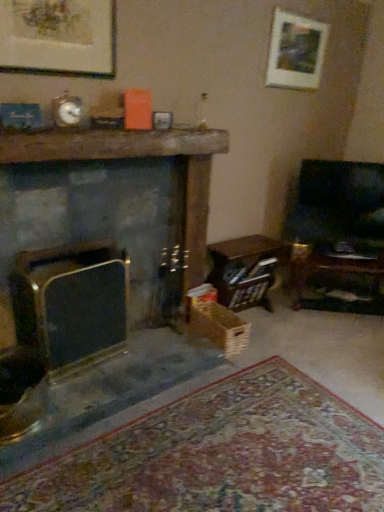
Measure the distance between point (72, 60) and camera.

Point (72, 60) and camera are 1.89 meters apart.

The width and height of the screenshot is (384, 512). Describe the element at coordinates (58, 37) in the screenshot. I see `matte gold picture frame at upper left, which appears as the 2th picture frame when viewed from the right` at that location.

The image size is (384, 512). What do you see at coordinates (219, 327) in the screenshot?
I see `wooden crate at lower center` at bounding box center [219, 327].

Image resolution: width=384 pixels, height=512 pixels. Find the location of `dark gray stone fireplace at center, placed as the 1th fireplace when sorted from right to left`. dark gray stone fireplace at center, placed as the 1th fireplace when sorted from right to left is located at coordinates (138, 157).

Measure the distance between dark wood rocking chair at right and camera.

The depth of dark wood rocking chair at right is 2.85 meters.

The height and width of the screenshot is (512, 384). Find the location of `matte gold picture frame at upper left, the 1th picture frame ordered from the bottom`. matte gold picture frame at upper left, the 1th picture frame ordered from the bottom is located at coordinates (58, 37).

How much distance is there between dark wood rocking chair at right and white matte picture frame at upper right, the second picture frame from the bottom?

32.76 inches.

Which object is closer to the camera, dark wood rocking chair at right or white matte picture frame at upper right, the second picture frame from the bottom?

white matte picture frame at upper right, the second picture frame from the bottom, is in front.

From a real-world perspective, is dark wood rocking chair at right on white matte picture frame at upper right, which is counted as the 1th picture frame, starting from the top?

Incorrect, from a real-world perspective, dark wood rocking chair at right is lower than white matte picture frame at upper right, which is counted as the 1th picture frame, starting from the top.

Considering the positions of point (304, 192) and point (315, 58), is point (304, 192) closer or farther from the camera than point (315, 58)?

Point (304, 192) is positioned farther from the camera compared to point (315, 58).

Considering the sizes of objects white matte picture frame at upper right, which is counted as the 1th picture frame, starting from the top, and matte black fireplace at left, which is the first fireplace from left to right, in the image provided, who is thinner, white matte picture frame at upper right, which is counted as the 1th picture frame, starting from the top, or matte black fireplace at left, which is the first fireplace from left to right,?

Thinner between the two is white matte picture frame at upper right, which is counted as the 1th picture frame, starting from the top.

Which object is closer to the camera taking this photo, white matte picture frame at upper right, the second picture frame from the bottom, or matte black fireplace at left, which is the first fireplace from left to right?

matte black fireplace at left, which is the first fireplace from left to right, is in front.

From the image's perspective, is white matte picture frame at upper right, acting as the first picture frame starting from the back, located above or below matte black fireplace at left, which is the first fireplace from left to right?

white matte picture frame at upper right, acting as the first picture frame starting from the back, is above matte black fireplace at left, which is the first fireplace from left to right.

Which object is positioned more to the left, white matte picture frame at upper right, placed as the 2th picture frame when sorted from front to back, or matte black fireplace at left, which is the first fireplace from left to right?

matte black fireplace at left, which is the first fireplace from left to right.

Does wooden crate at lower right have a larger size compared to matte gold picture frame at upper left, which is the 2th picture frame in top-to-bottom order?

Indeed, wooden crate at lower right has a larger size compared to matte gold picture frame at upper left, which is the 2th picture frame in top-to-bottom order.

Is wooden crate at lower right facing towards matte gold picture frame at upper left, which is the 2th picture frame in top-to-bottom order?

No, wooden crate at lower right is not aimed at matte gold picture frame at upper left, which is the 2th picture frame in top-to-bottom order.

Does point (248, 288) come closer to viewer compared to point (97, 1)?

No.

Which of these two, wooden crate at lower right or matte gold picture frame at upper left, the 1th picture frame in the front-to-back sequence, is wider?

With larger width is wooden crate at lower right.

Considering the sizes of dark gray stone fireplace at center, placed as the 1th fireplace when sorted from right to left, and matte black fireplace at left, which is the first fireplace from left to right, in the image, is dark gray stone fireplace at center, placed as the 1th fireplace when sorted from right to left, wider or thinner than matte black fireplace at left, which is the first fireplace from left to right,?

dark gray stone fireplace at center, placed as the 1th fireplace when sorted from right to left, is wider than matte black fireplace at left, which is the first fireplace from left to right.

From the picture: Is dark gray stone fireplace at center, placed as the 1th fireplace when sorted from right to left, at the left side of matte black fireplace at left, the second fireplace positioned from the right?

No, dark gray stone fireplace at center, placed as the 1th fireplace when sorted from right to left, is not to the left of matte black fireplace at left, the second fireplace positioned from the right.

Is matte black fireplace at left, the second fireplace positioned from the right, surrounded by dark gray stone fireplace at center, which is the second fireplace in left-to-right order?

That's incorrect, matte black fireplace at left, the second fireplace positioned from the right, is not inside dark gray stone fireplace at center, which is the second fireplace in left-to-right order.

Is dark gray stone fireplace at center, which is the second fireplace in left-to-right order, positioned before matte black fireplace at left, which is the first fireplace from left to right?

Yes, dark gray stone fireplace at center, which is the second fireplace in left-to-right order, is closer to the camera.

Where is `the 2nd fireplace to the right of the matte gold picture frame at upper left, the 1th picture frame ordered from the bottom, starting your count from the anchor`? This screenshot has width=384, height=512. the 2nd fireplace to the right of the matte gold picture frame at upper left, the 1th picture frame ordered from the bottom, starting your count from the anchor is located at coordinates (138, 157).

Is matte gold picture frame at upper left, the 1th picture frame in the front-to-back sequence, oriented away from dark gray stone fireplace at center, which is the second fireplace in left-to-right order?

That's not correct — matte gold picture frame at upper left, the 1th picture frame in the front-to-back sequence, is not looking away from dark gray stone fireplace at center, which is the second fireplace in left-to-right order.

How distant is matte gold picture frame at upper left, arranged as the 2th picture frame when viewed from the back, from dark gray stone fireplace at center, placed as the 1th fireplace when sorted from right to left?

matte gold picture frame at upper left, arranged as the 2th picture frame when viewed from the back, is 19.67 inches from dark gray stone fireplace at center, placed as the 1th fireplace when sorted from right to left.

Is point (12, 12) positioned behind point (37, 136)?

Yes, it is.

Is wooden crate at lower center wider than matte black fireplace at left, which is the first fireplace from left to right?

Yes, wooden crate at lower center is wider than matte black fireplace at left, which is the first fireplace from left to right.

Is wooden crate at lower center turned away from matte black fireplace at left, the second fireplace positioned from the right?

No, wooden crate at lower center is not facing away from matte black fireplace at left, the second fireplace positioned from the right.

Does wooden crate at lower center have a greater height compared to matte black fireplace at left, which is the first fireplace from left to right?

No, wooden crate at lower center is not taller than matte black fireplace at left, which is the first fireplace from left to right.

Is point (206, 317) positioned behind point (236, 270)?

No, it is in front of (236, 270).

From the image's perspective, between wooden crate at lower center and wooden crate at lower right, who is located below?

wooden crate at lower center is shown below in the image.

Who is taller, wooden crate at lower center or wooden crate at lower right?

wooden crate at lower right is taller.

Where is `the 1st picture frame in front when counting from the dark wood rocking chair at right`? the 1st picture frame in front when counting from the dark wood rocking chair at right is located at coordinates (296, 51).

I want to click on the 2nd fireplace to the left when counting from the white matte picture frame at upper right, the second picture frame from the bottom, so tap(71, 303).

When comparing their distances from wooden crate at lower right, does white matte picture frame at upper right, the second picture frame from the bottom, or matte gold picture frame at upper left, which appears as the 2th picture frame when viewed from the right, seem closer?

white matte picture frame at upper right, the second picture frame from the bottom, is positioned closer to the anchor wooden crate at lower right.

Based on the photo, looking at the image, which one is located further to matte black fireplace at left, which is the first fireplace from left to right, wooden crate at lower center or matte gold picture frame at upper left, which is the 2th picture frame in top-to-bottom order?

The object further to matte black fireplace at left, which is the first fireplace from left to right, is matte gold picture frame at upper left, which is the 2th picture frame in top-to-bottom order.

From the image, which object appears to be nearer to matte gold picture frame at upper left, which appears as the 2th picture frame when viewed from the right, wooden crate at lower center or dark wood rocking chair at right?

wooden crate at lower center lies closer to matte gold picture frame at upper left, which appears as the 2th picture frame when viewed from the right, than the other object.

Considering their positions, is matte gold picture frame at upper left, which appears as the 2th picture frame when viewed from the right, positioned further to white matte picture frame at upper right, placed as the 2th picture frame when sorted from front to back, than dark gray stone fireplace at center, which is the second fireplace in left-to-right order?

matte gold picture frame at upper left, which appears as the 2th picture frame when viewed from the right, is further to white matte picture frame at upper right, placed as the 2th picture frame when sorted from front to back.

Based on their spatial positions, is dark wood rocking chair at right or wooden crate at lower right further from white matte picture frame at upper right, the 1th picture frame viewed from the right?

wooden crate at lower right is positioned further to the anchor white matte picture frame at upper right, the 1th picture frame viewed from the right.

Which object lies further to the anchor point matte black fireplace at left, which is the first fireplace from left to right, matte gold picture frame at upper left, arranged as the 2th picture frame when viewed from the back, or dark gray stone fireplace at center, which is the second fireplace in left-to-right order?

The object further to matte black fireplace at left, which is the first fireplace from left to right, is matte gold picture frame at upper left, arranged as the 2th picture frame when viewed from the back.

When comparing their distances from dark gray stone fireplace at center, which is the second fireplace in left-to-right order, does white matte picture frame at upper right, placed as the 2th picture frame when sorted from front to back, or wooden crate at lower right seem further?

Among the two, white matte picture frame at upper right, placed as the 2th picture frame when sorted from front to back, is located further to dark gray stone fireplace at center, which is the second fireplace in left-to-right order.

Which object lies nearer to the anchor point white matte picture frame at upper right, the 1th picture frame viewed from the right, wooden crate at lower right or dark gray stone fireplace at center, placed as the 1th fireplace when sorted from right to left?

Among the two, dark gray stone fireplace at center, placed as the 1th fireplace when sorted from right to left, is located nearer to white matte picture frame at upper right, the 1th picture frame viewed from the right.

The width and height of the screenshot is (384, 512). I want to click on picture frame between matte black fireplace at left, the second fireplace positioned from the right, and dark wood rocking chair at right, in the horizontal direction, so click(296, 51).

Image resolution: width=384 pixels, height=512 pixels. In order to click on table between matte gold picture frame at upper left, placed as the first picture frame when sorted from left to right, and wooden crate at lower center in the up-down direction in this screenshot , I will do `click(246, 270)`.

Find the location of a particular element. This screenshot has width=384, height=512. rocking chair between white matte picture frame at upper right, the 2th picture frame in the left-to-right sequence, and wooden crate at lower right in the up-down direction is located at coordinates (339, 207).

Where is `fireplace between matte black fireplace at left, which is the first fireplace from left to right, and wooden crate at lower center`? fireplace between matte black fireplace at left, which is the first fireplace from left to right, and wooden crate at lower center is located at coordinates (138, 157).